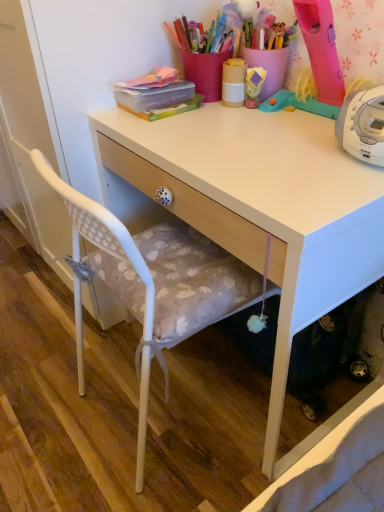
Where is `vacant space in front of matte yellow cup at upper center`? The height and width of the screenshot is (512, 384). vacant space in front of matte yellow cup at upper center is located at coordinates (238, 125).